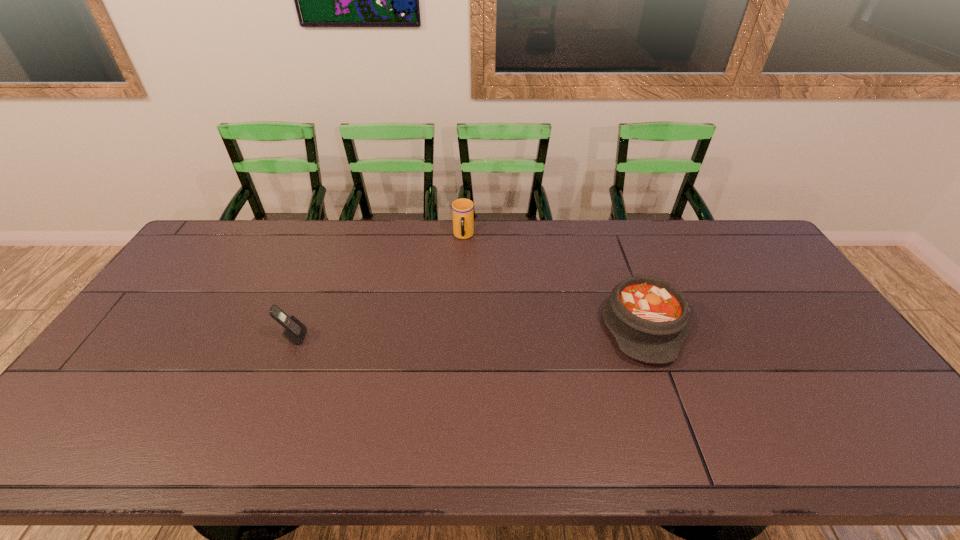
I want to click on vacant space that satisfies the following two spatial constraints: 1. on the side of the cup with the handle; 2. on the front-facing side of the cellular telephone, so click(459, 337).

This screenshot has width=960, height=540. I want to click on vacant area in the image that satisfies the following two spatial constraints: 1. on the side of the casserole with the handle; 2. on the left side of the cup, so click(x=460, y=325).